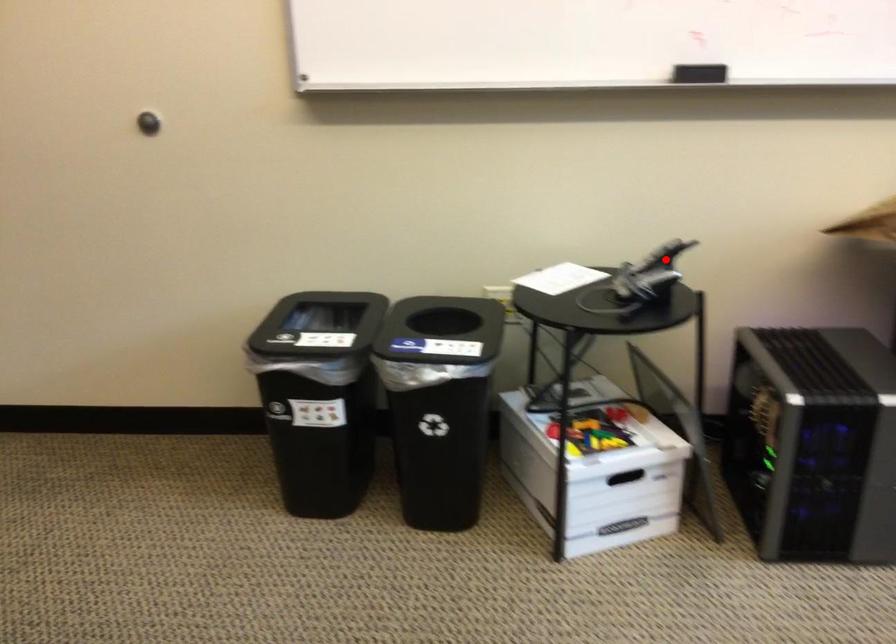
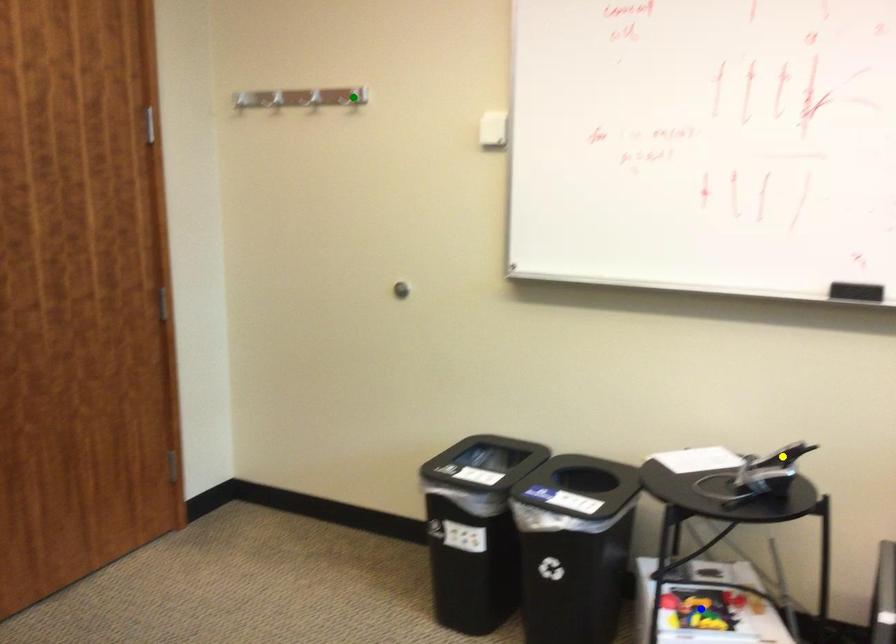
Question: I am providing you with two images of the same scene from different viewpoints. A red point is marked on the first image. You are given multiple points on the second image. Which point in image 2 represents the same 3d spot as the red point in image 1?

Choices:
 (A) yellow point
 (B) green point
 (C) blue point

Answer: (A)